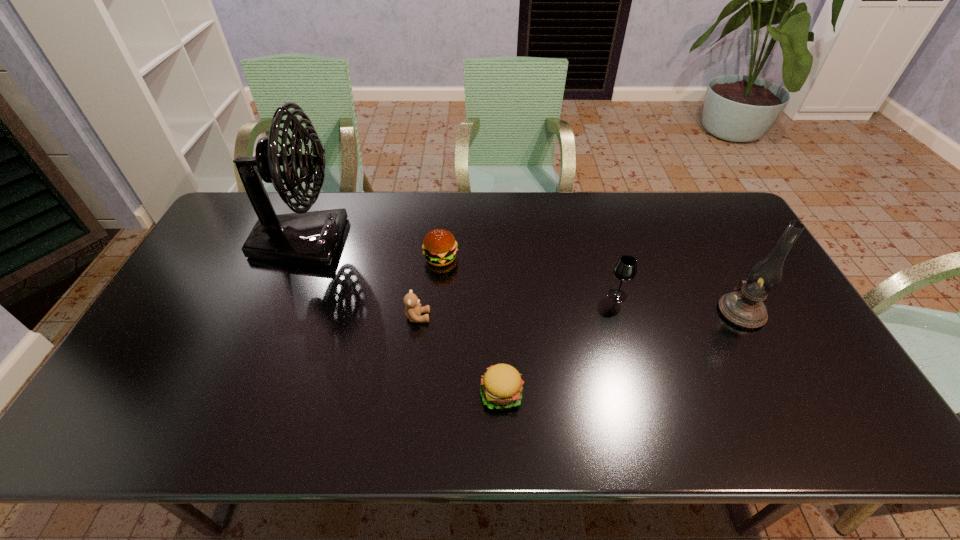
The height and width of the screenshot is (540, 960). I want to click on vacant point located between the left hamburger and the oil lamp, so click(591, 285).

Find the location of `vacant space in between the rightmost object and the wineglass`. vacant space in between the rightmost object and the wineglass is located at coordinates (679, 303).

Find the location of a particular element. The width and height of the screenshot is (960, 540). free spot between the tallest object and the farther hamburger is located at coordinates (371, 250).

Where is `blank region between the oil lamp and the right hamburger`? blank region between the oil lamp and the right hamburger is located at coordinates (621, 353).

Locate an element on the screen. The height and width of the screenshot is (540, 960). free area in between the teddy bear and the third tallest object is located at coordinates (517, 306).

This screenshot has height=540, width=960. I want to click on free space between the third tallest object and the leftmost object, so click(459, 269).

The height and width of the screenshot is (540, 960). In order to click on free spot between the fifth shortest object and the teddy bear in this screenshot , I will do `click(580, 314)`.

I want to click on free spot between the farther hamburger and the fifth shortest object, so coord(591,285).

Identify which object is the second nearest to the leftmost object. Please provide its 2D coordinates. Your answer should be formatted as a tuple, i.e. [(x, y)], where the tuple contains the x and y coordinates of a point satisfying the conditions above.

[(413, 309)]

Locate an element on the screen. The width and height of the screenshot is (960, 540). the second closest object relative to the wineglass is located at coordinates (501, 386).